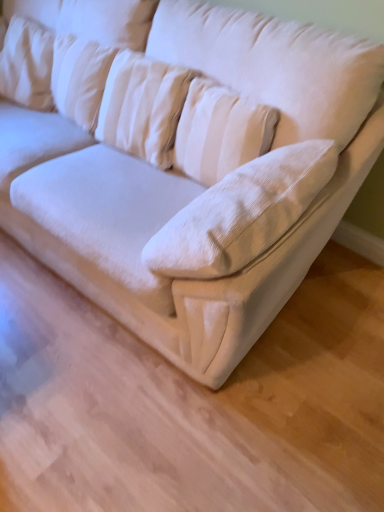
This screenshot has width=384, height=512. Identify the location of white cotton pillow at center. (143, 106).

Image resolution: width=384 pixels, height=512 pixels. What do you see at coordinates (143, 106) in the screenshot?
I see `white cotton pillow at center` at bounding box center [143, 106].

Where is `white cotton pillow at center`? This screenshot has height=512, width=384. white cotton pillow at center is located at coordinates (143, 106).